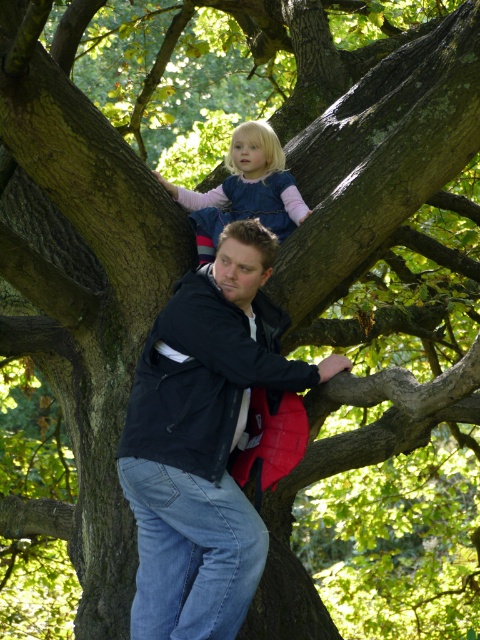
You are standing in the park and see two points marked on a large tree. The first point is at coordinates point (228,278) and the second is at point (300,196). Which point is closer to you?

Point (228,278) is in front of point (300,196), so it is closer to you.